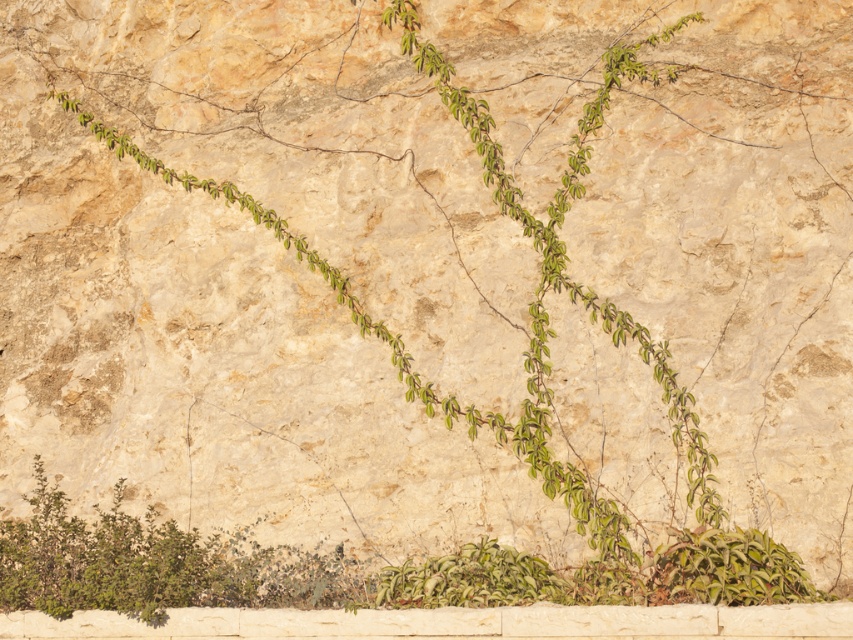
Question: Is green leafy bush at lower left positioned behind green leafy plant at lower right?

Choices:
 (A) yes
 (B) no

Answer: (A)

Question: Among these points, which one is farthest from the camera?

Choices:
 (A) (671, 586)
 (B) (38, 579)

Answer: (B)

Question: Does green leafy bush at lower left appear on the left side of green leafy plant at lower right?

Choices:
 (A) no
 (B) yes

Answer: (B)

Question: Among these points, which one is nearest to the camera?

Choices:
 (A) 363,596
 (B) 708,600

Answer: (B)

Question: Is green leafy bush at lower left smaller than green leafy plant at lower right?

Choices:
 (A) yes
 (B) no

Answer: (B)

Question: Among these objects, which one is nearest to the camera?

Choices:
 (A) green leafy plant at lower right
 (B) green leafy bush at lower left

Answer: (A)